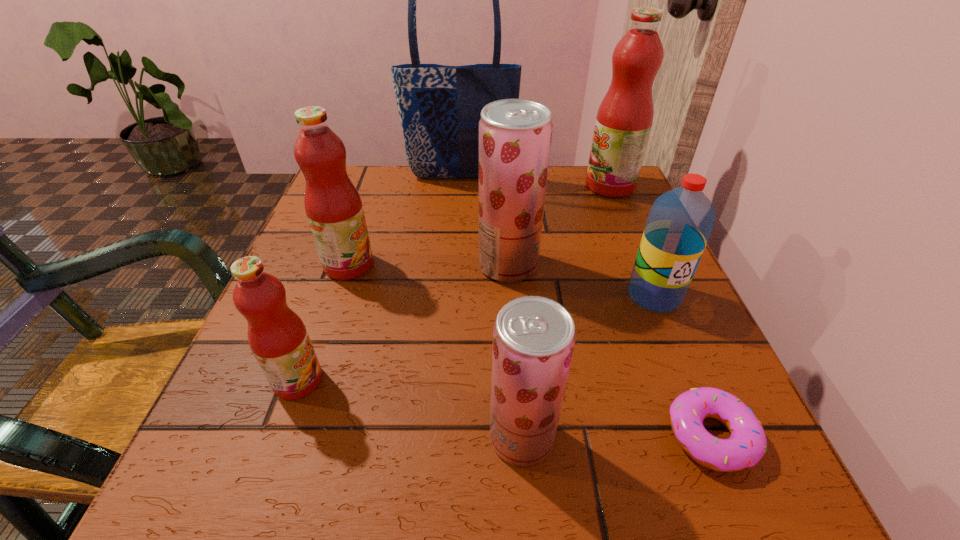
The width and height of the screenshot is (960, 540). In order to click on pink doughnut in this screenshot , I will do `click(747, 444)`.

At what (x,y) coordinates should I click in order to perform the action: click on the shortest object. Please return your answer as a coordinate pair (x, y). The width and height of the screenshot is (960, 540). Looking at the image, I should click on (747, 444).

Find the location of a particular element. Image resolution: width=960 pixels, height=540 pixels. blank space located on the front-facing side of the shopping bag is located at coordinates (452, 288).

Identify the location of free space located on the front label of the farthest pink fruit juice. This screenshot has height=540, width=960. (486, 186).

The height and width of the screenshot is (540, 960). Find the location of `free space located on the front label of the farthest pink fruit juice`. free space located on the front label of the farthest pink fruit juice is located at coordinates (523, 186).

Find the location of `free space located on the front label of the farthest pink fruit juice`. free space located on the front label of the farthest pink fruit juice is located at coordinates (503, 186).

Identify the location of free region located 0.180m on the left of the bigger strawberry fruit juice. (385, 265).

Where is `vacant space located on the front label of the second smallest pink fruit juice`? Image resolution: width=960 pixels, height=540 pixels. vacant space located on the front label of the second smallest pink fruit juice is located at coordinates (509, 265).

You are a GUI agent. You are given a task and a screenshot of the screen. Output one action in this format:
    pyautogui.click(x=<x>, y=<y>)
    Task: Click on the blank area located 0.090m on the front label of the red water bottle
    The image size is (960, 540).
    Given the screenshot: What is the action you would take?
    pyautogui.click(x=680, y=357)

The height and width of the screenshot is (540, 960). What are the coordinates of `vacant area situated 0.060m on the back of the nearest fruit juice` in the screenshot? It's located at pyautogui.click(x=516, y=373).